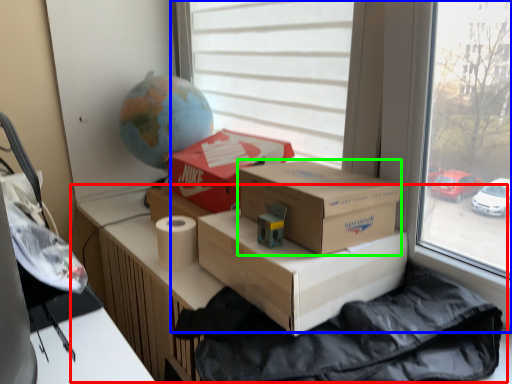
Question: Which object is positioned farthest from table (highlighted by a red box)? Select from window (highlighted by a blue box) and box (highlighted by a green box).

Choices:
 (A) window
 (B) box

Answer: (A)